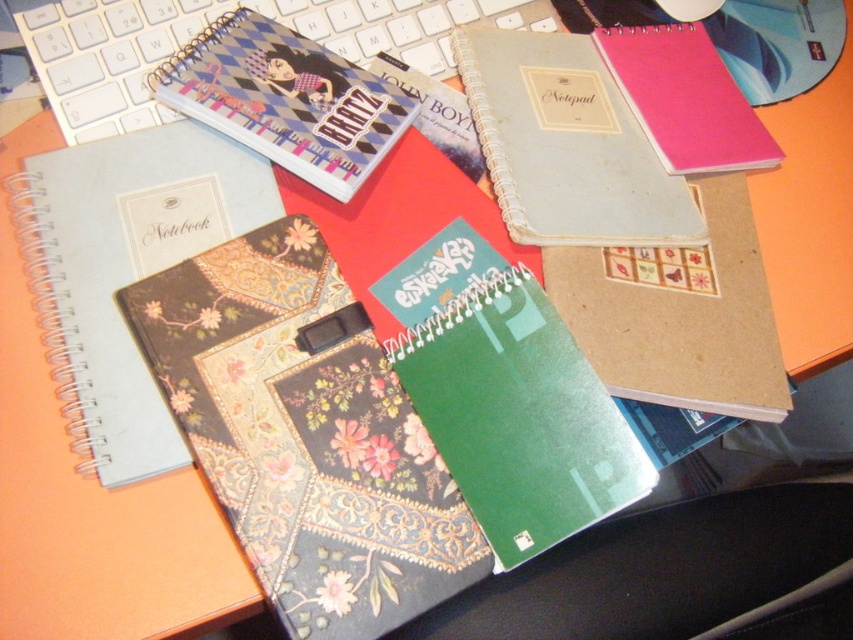
Question: Among these points, which one is farthest from the camera?

Choices:
 (A) (610, 45)
 (B) (387, 88)
 (C) (224, 305)

Answer: (A)

Question: Which of these objects is positioned farthest from the matte plastic notebook at upper center?

Choices:
 (A) white plastic keyboard at upper left
 (B) matte floral notebook at left

Answer: (B)

Question: Does matte floral notebook at left lie in front of matte plastic notebook at upper center?

Choices:
 (A) no
 (B) yes

Answer: (B)

Question: Is the position of floral-patterned fabric binder at center more distant than that of matte plastic notebook at upper center?

Choices:
 (A) yes
 (B) no

Answer: (B)

Question: Which object is closer to the camera taking this photo?

Choices:
 (A) white plastic keyboard at upper left
 (B) pink matte notebook at upper right
 (C) matte floral notebook at left
 (D) floral-patterned fabric binder at center

Answer: (D)

Question: Is floral-patterned fabric binder at center bigger than white plastic keyboard at upper left?

Choices:
 (A) yes
 (B) no

Answer: (A)